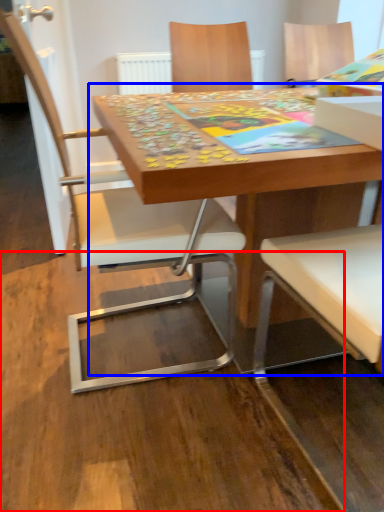
Question: Which of the following is the closest to the observer, plywood (highlighted by a red box) or table (highlighted by a blue box)?

Choices:
 (A) plywood
 (B) table

Answer: (A)